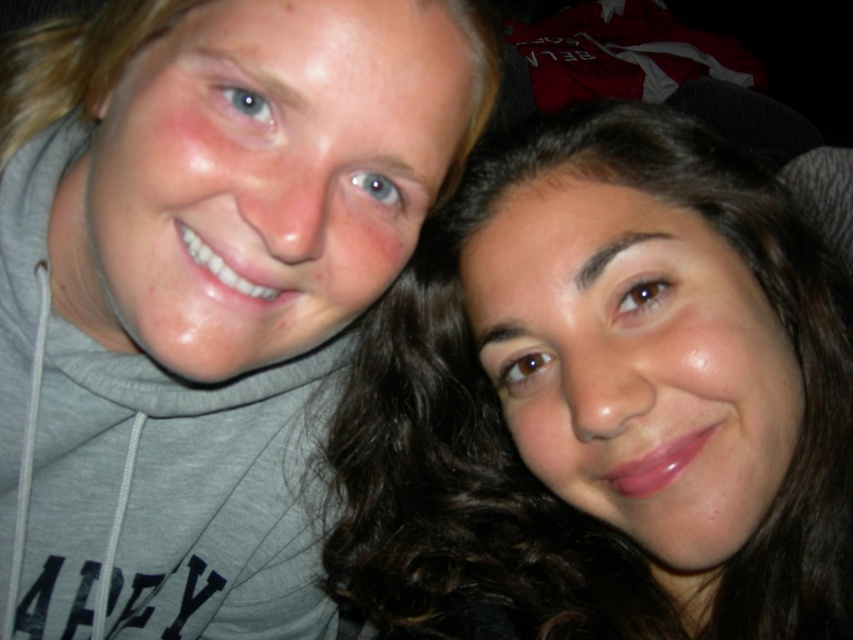
You are a photographer trying to frame a photo of the matte gray hoodie at upper left and the smooth brown hair at center. Which object should you adjust your camera focus to first if you want to capture both clearly, considering their sizes?

The matte gray hoodie at upper left is larger in width than the smooth brown hair at center, so you should focus on the matte gray hoodie at upper left first to ensure it is in clear focus before adjusting for the smaller smooth brown hair at center.

You are a photographer trying to adjust the lighting for a photo shoot. You notice the matte gray hoodie at upper left and the smooth brown hair at center. Which object should you focus the spotlight on to ensure it reaches the taller one first?

The matte gray hoodie at upper left is taller than the smooth brown hair at center, so you should focus the spotlight on the matte gray hoodie at upper left first to ensure proper lighting.

Consider the image. You are a photographer trying to capture a closeup of the matte gray hoodie at upper left and the smooth brown hair at center. Since the camera can only focus on objects within 5 inches of each other, will both objects be in focus?

The matte gray hoodie at upper left is 5.08 inches from the smooth brown hair at center. Since the distance exceeds the camera focus range of 5 inches, the objects will not both be in focus.